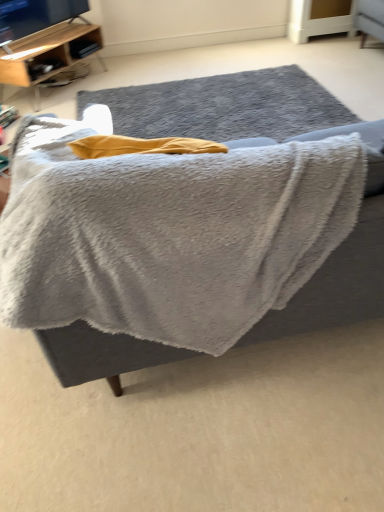
Question: Is gray fluffy blanket at center to the left of gray woolen rug at center from the viewer's perspective?

Choices:
 (A) no
 (B) yes

Answer: (B)

Question: Is gray fluffy blanket at center bigger than gray woolen rug at center?

Choices:
 (A) yes
 (B) no

Answer: (A)

Question: Considering the relative sizes of gray fluffy blanket at center and gray woolen rug at center in the image provided, is gray fluffy blanket at center smaller than gray woolen rug at center?

Choices:
 (A) no
 (B) yes

Answer: (A)

Question: Could you tell me if gray fluffy blanket at center is turned towards gray woolen rug at center?

Choices:
 (A) yes
 (B) no

Answer: (A)

Question: Is gray fluffy blanket at center thinner than gray woolen rug at center?

Choices:
 (A) yes
 (B) no

Answer: (A)

Question: Is gray fluffy blanket at center inside the boundaries of wooden shelf at upper left, or outside?

Choices:
 (A) outside
 (B) inside

Answer: (A)

Question: Is gray fluffy blanket at center in front of or behind wooden shelf at upper left in the image?

Choices:
 (A) behind
 (B) front

Answer: (B)

Question: Considering the positions of gray fluffy blanket at center and wooden shelf at upper left in the image, is gray fluffy blanket at center wider or thinner than wooden shelf at upper left?

Choices:
 (A) thin
 (B) wide

Answer: (B)

Question: Based on their positions, is gray fluffy blanket at center located to the left or right of wooden shelf at upper left?

Choices:
 (A) left
 (B) right

Answer: (B)

Question: From the image's perspective, is wooden shelf at upper left above or below gray fluffy blanket at center?

Choices:
 (A) below
 (B) above

Answer: (B)

Question: Would you say wooden shelf at upper left is to the left or to the right of gray fluffy blanket at center in the picture?

Choices:
 (A) right
 (B) left

Answer: (B)

Question: Considering the positions of point click(1, 70) and point click(350, 257), is point click(1, 70) closer or farther from the camera than point click(350, 257)?

Choices:
 (A) farther
 (B) closer

Answer: (A)

Question: From a real-world perspective, is wooden shelf at upper left above or below gray fluffy blanket at center?

Choices:
 (A) below
 (B) above

Answer: (A)

Question: Would you say gray woolen rug at center is to the left or to the right of wooden shelf at upper left in the picture?

Choices:
 (A) left
 (B) right

Answer: (B)

Question: In the image, is gray woolen rug at center positioned in front of or behind wooden shelf at upper left?

Choices:
 (A) front
 (B) behind

Answer: (A)